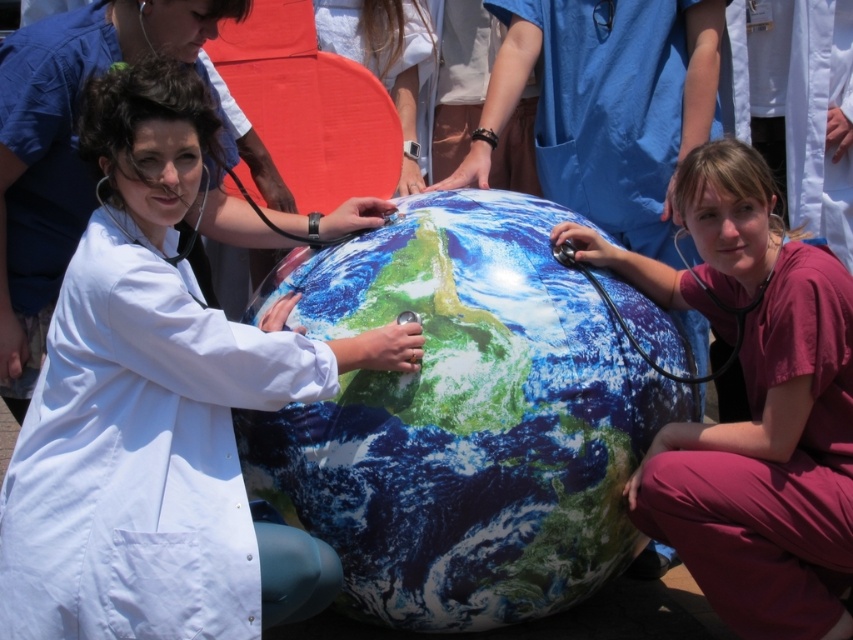
You are a medical student observing the scene and need to retrieve the black rubber stethoscope at left. Can you reach it without moving the matte white coat at center?

The matte white coat at center is positioned over the black rubber stethoscope at left, so you cannot reach the stethoscope without moving the coat.